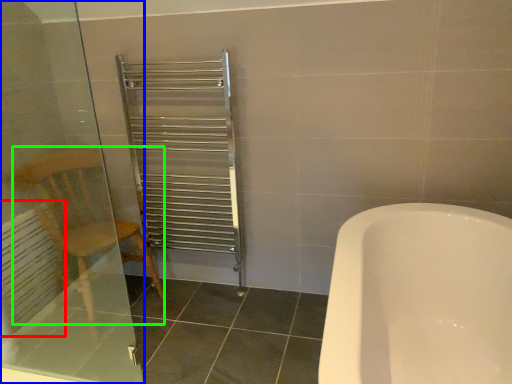
Question: Which object is positioned closest to radiator (highlighted by a red box)? Select from screen door (highlighted by a blue box) and armchair (highlighted by a green box).

Choices:
 (A) screen door
 (B) armchair

Answer: (A)